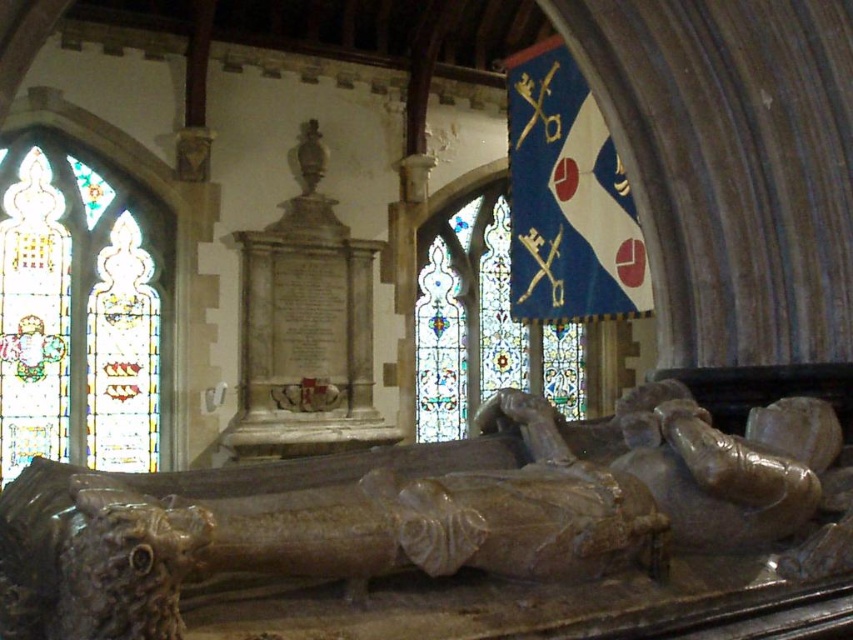
You are a tour guide standing at the entrance of the historic church. You want to point out the brown polished stone effigy at lower center to your visitors. Is it possible for them to see the effigy clearly from where they are standing?

The brown polished stone effigy at lower center is 7.97 meters from camera, so yes, the visitors can see the effigy clearly from where they are standing as it is within a reasonable viewing distance.

Looking at this image, you are an architect planning to install a new lighting system in the church. You need to determine which stained glass panel, the stained glass window at left or the blue stained glass at upper center, requires a wider frame to accommodate its size. Based on the scene description, which one would need a larger frame?

The blue stained glass at upper center requires a wider frame because its width is greater than the stained glass window at left.

You are standing at the entrance of the church and see the brown polished stone effigy at lower center. Where would you look to find the point marked at coordinate (x=426, y=509)?

The point marked at coordinate (x=426, y=509) is located on the brown polished stone effigy at lower center.